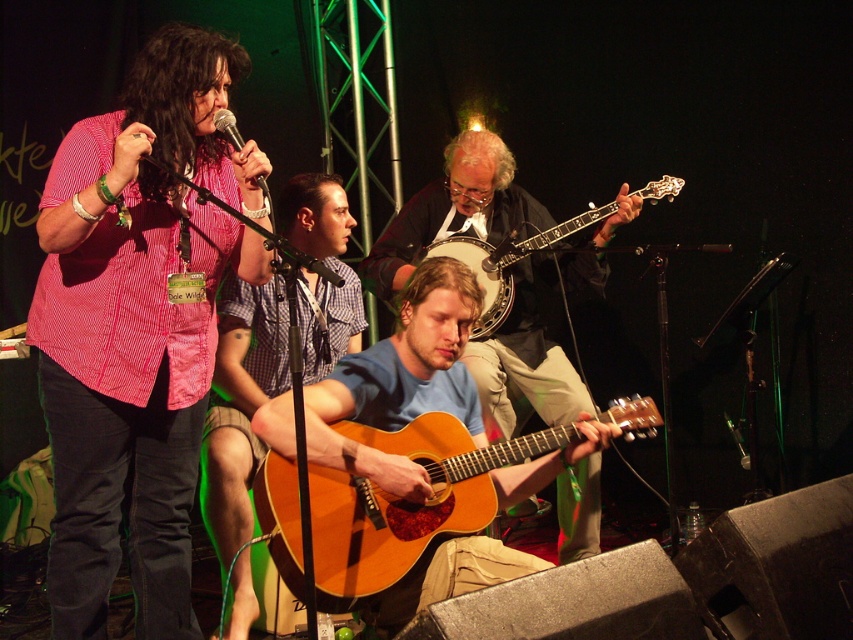
You are a stagehand who needs to place a 1.2 meter wide equipment cart between the light brown wood acoustic guitar at center and the wooden banjo at center. Can the cart fit between them?

The light brown wood acoustic guitar at center is wider than the wooden banjo at center, but the description does not provide the exact distance between them. Therefore, it is unclear if the 1.2 meter wide equipment cart can fit between them.

You are a photographer at the back of the venue trying to capture the singer wearing the matte pink shirt at center and the matte black microphone at upper center. Which object should you focus on first if you want to frame them both in the same shot?

The matte pink shirt at center is to the left of the matte black microphone at upper center, so you should focus on the matte pink shirt at center first to ensure both are in frame.